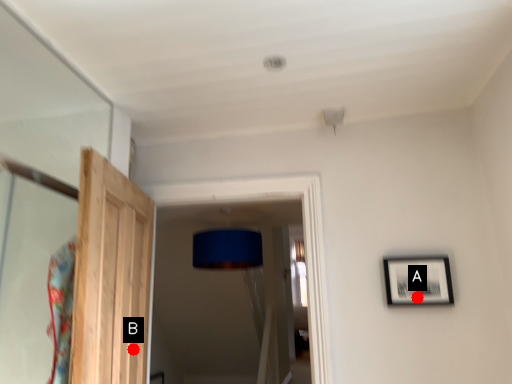
Question: Two points are circled on the image, labeled by A and B beside each circle. Which of the following is the closest to the observer?

Choices:
 (A) A is closer
 (B) B is closer

Answer: (B)